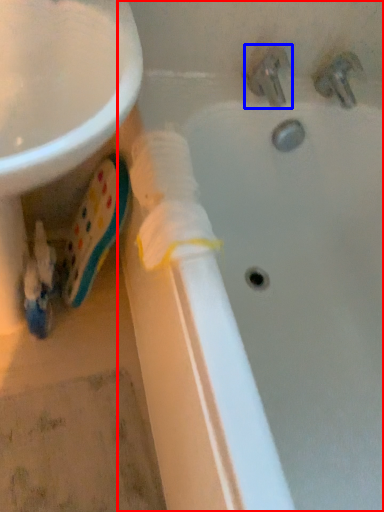
Question: Which of the following is the closest to the observer, bathtub (highlighted by a red box) or tap (highlighted by a blue box)?

Choices:
 (A) bathtub
 (B) tap

Answer: (A)